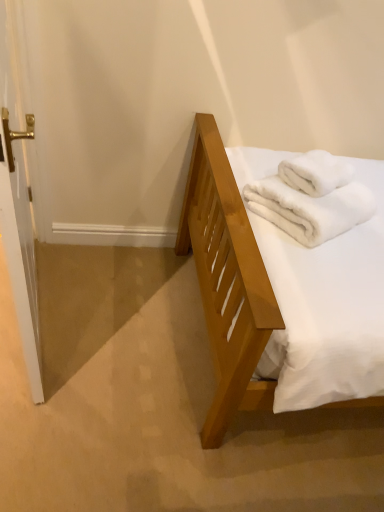
Question: Is point (350, 202) closer or farther from the camera than point (23, 302)?

Choices:
 (A) farther
 (B) closer

Answer: (A)

Question: Which is correct: white fluffy bath towel at upper right, the second bath towel viewed from the top, is inside white glossy door handle at left, or outside of it?

Choices:
 (A) outside
 (B) inside

Answer: (A)

Question: Which object is the farthest from the white fluffy bath towel at upper right, the second bath towel viewed from the top?

Choices:
 (A) white fluffy bath towel at upper right, placed as the second bath towel when sorted from bottom to top
 (B) white glossy door handle at left

Answer: (B)

Question: Estimate the real-world distances between objects in this image. Which object is farther from the white fluffy bath towel at upper right, placed as the second bath towel when sorted from bottom to top?

Choices:
 (A) white fluffy bath towel at upper right, the second bath towel viewed from the top
 (B) white glossy door handle at left

Answer: (B)